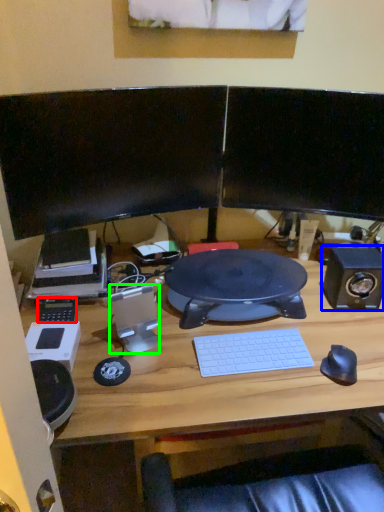
Question: Which object is positioned closest to equipment (highlighted by a red box)? Select from speaker (highlighted by a blue box) and speaker (highlighted by a green box).

Choices:
 (A) speaker
 (B) speaker

Answer: (B)